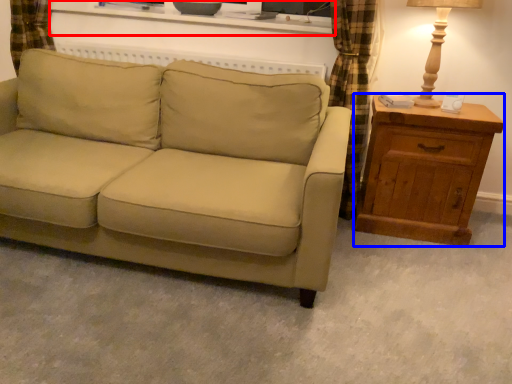
Question: Which object appears farthest to the camera in this image, entertainment center (highlighted by a red box) or chest of drawers (highlighted by a blue box)?

Choices:
 (A) entertainment center
 (B) chest of drawers

Answer: (A)